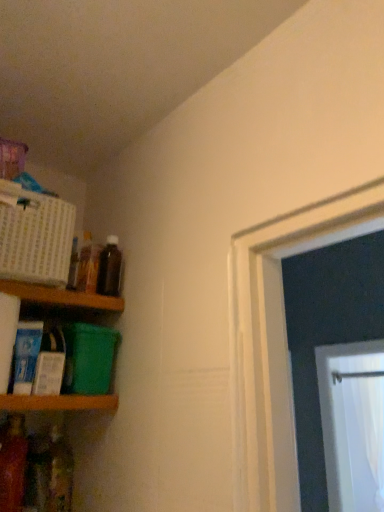
At what (x,y) coordinates should I click in order to perform the action: click on wooden shelf at left, placed as the second shelf when sorted from bottom to top. Please return your answer as a coordinate pair (x, y). Looking at the image, I should click on (61, 297).

What do you see at coordinates (54, 472) in the screenshot?
I see `translucent plastic bottle at lower left, placed as the fourth bottle when sorted from top to bottom` at bounding box center [54, 472].

Image resolution: width=384 pixels, height=512 pixels. Find the location of `translucent plastic bottle at lower left, arranged as the fourth bottle when viewed from the right`. translucent plastic bottle at lower left, arranged as the fourth bottle when viewed from the right is located at coordinates (13, 464).

This screenshot has width=384, height=512. I want to click on wooden shelf at left, placed as the second shelf when sorted from bottom to top, so click(61, 297).

Is translucent plastic bottle at lower left, arranged as the fourth bottle when viewed from the right, aimed at wooden shelf at lower left, arranged as the second shelf when viewed from the top?

No, translucent plastic bottle at lower left, arranged as the fourth bottle when viewed from the right, is not turned towards wooden shelf at lower left, arranged as the second shelf when viewed from the top.

Between translucent plastic bottle at lower left, arranged as the fourth bottle when viewed from the right, and wooden shelf at lower left, placed as the 1th shelf when sorted from bottom to top, which one has larger size?

With larger size is wooden shelf at lower left, placed as the 1th shelf when sorted from bottom to top.

From the image's perspective, is translucent plastic bottle at lower left, placed as the 3th bottle when sorted from top to bottom, above or below wooden shelf at lower left, arranged as the second shelf when viewed from the top?

translucent plastic bottle at lower left, placed as the 3th bottle when sorted from top to bottom, is below wooden shelf at lower left, arranged as the second shelf when viewed from the top.

Who is taller, translucent plastic bottle at lower left, which is the 2th bottle in bottom-to-top order, or wooden shelf at lower left, arranged as the second shelf when viewed from the top?

translucent plastic bottle at lower left, which is the 2th bottle in bottom-to-top order, is taller.

Based on their positions, is brown glass bottle at upper left, which is the fourth bottle from left to right, located to the left or right of translucent plastic bottle at lower left, which appears as the 1th bottle when ordered from the bottom?

From the image, it's evident that brown glass bottle at upper left, which is the fourth bottle from left to right, is to the right of translucent plastic bottle at lower left, which appears as the 1th bottle when ordered from the bottom.

Is brown glass bottle at upper left, which is the 4th bottle in bottom-to-top order, surrounding translucent plastic bottle at lower left, which is the third bottle in right-to-left order?

No.

Does point (104, 256) come in front of point (49, 453)?

Yes, point (104, 256) is closer to viewer.

Based on the photo, which of these two, brown glass bottle at upper left, the 1th bottle when ordered from right to left, or translucent plastic bottle at lower left, the 2th bottle from the left, stands taller?

Standing taller between the two is translucent plastic bottle at lower left, the 2th bottle from the left.

What's the angular difference between wooden shelf at lower left, placed as the 1th shelf when sorted from bottom to top, and wooden shelf at left, which is counted as the 1th shelf, starting from the top,'s facing directions?

There is a 0-degree angle between the facing directions of wooden shelf at lower left, placed as the 1th shelf when sorted from bottom to top, and wooden shelf at left, which is counted as the 1th shelf, starting from the top.

Would you say wooden shelf at lower left, arranged as the second shelf when viewed from the top, is inside or outside wooden shelf at left, placed as the second shelf when sorted from bottom to top?

wooden shelf at lower left, arranged as the second shelf when viewed from the top, lies outside wooden shelf at left, placed as the second shelf when sorted from bottom to top.

Considering the relative positions of wooden shelf at lower left, placed as the 1th shelf when sorted from bottom to top, and wooden shelf at left, which is counted as the 1th shelf, starting from the top, in the image provided, is wooden shelf at lower left, placed as the 1th shelf when sorted from bottom to top, to the left or to the right of wooden shelf at left, which is counted as the 1th shelf, starting from the top,?

wooden shelf at lower left, placed as the 1th shelf when sorted from bottom to top, is to the left of wooden shelf at left, which is counted as the 1th shelf, starting from the top.

Is wooden shelf at lower left, placed as the 1th shelf when sorted from bottom to top, oriented away from wooden shelf at left, which is counted as the 1th shelf, starting from the top?

No.

Can you confirm if translucent glass bottle at upper left, marked as the third bottle in a bottom-to-top arrangement, is bigger than wooden shelf at lower left, placed as the 1th shelf when sorted from bottom to top?

Actually, translucent glass bottle at upper left, marked as the third bottle in a bottom-to-top arrangement, might be smaller than wooden shelf at lower left, placed as the 1th shelf when sorted from bottom to top.

Could you tell me if translucent glass bottle at upper left, placed as the second bottle when sorted from right to left, is facing wooden shelf at lower left, arranged as the second shelf when viewed from the top?

No, translucent glass bottle at upper left, placed as the second bottle when sorted from right to left, is not facing towards wooden shelf at lower left, arranged as the second shelf when viewed from the top.

Which is behind, translucent glass bottle at upper left, marked as the third bottle in a bottom-to-top arrangement, or wooden shelf at lower left, arranged as the second shelf when viewed from the top?

translucent glass bottle at upper left, marked as the third bottle in a bottom-to-top arrangement, is further away from the camera.

Is point (78, 285) positioned in front of point (115, 409)?

No, (78, 285) is further to viewer.

Does point (70, 460) appear closer or farther from the camera than point (60, 296)?

Point (70, 460) is positioned farther from the camera compared to point (60, 296).

At what (x,y) coordinates should I click in order to perform the action: click on the 2nd bottle directly beneath the wooden shelf at left, placed as the second shelf when sorted from bottom to top (from a real-world perspective). Please return your answer as a coordinate pair (x, y). This screenshot has height=512, width=384. Looking at the image, I should click on [x=54, y=472].

Based on the photo, is the depth of translucent plastic bottle at lower left, which is the third bottle in right-to-left order, greater than that of wooden shelf at left, placed as the second shelf when sorted from bottom to top?

Yes, it is.

Does point (90, 274) come farther from viewer compared to point (101, 264)?

No, it is in front of (101, 264).

Is translucent glass bottle at upper left, placed as the second bottle when sorted from right to left, facing away from brown glass bottle at upper left, which is the first bottle from top to bottom?

No, translucent glass bottle at upper left, placed as the second bottle when sorted from right to left,'s orientation is not away from brown glass bottle at upper left, which is the first bottle from top to bottom.

Measure the distance from translucent glass bottle at upper left, placed as the second bottle when sorted from right to left, to brown glass bottle at upper left, which is the first bottle from top to bottom.

translucent glass bottle at upper left, placed as the second bottle when sorted from right to left, and brown glass bottle at upper left, which is the first bottle from top to bottom, are 1.31 inches apart.

Which of these two, translucent glass bottle at upper left, acting as the 2th bottle starting from the top, or brown glass bottle at upper left, which is the fourth bottle from left to right, is smaller?

translucent glass bottle at upper left, acting as the 2th bottle starting from the top.

The height and width of the screenshot is (512, 384). What are the coordinates of `the 1st bottle located beneath the wooden shelf at left, which is counted as the 1th shelf, starting from the top (from a real-world perspective)` in the screenshot? It's located at (13, 464).

In the image, is wooden shelf at left, placed as the second shelf when sorted from bottom to top, on the left side or the right side of translucent plastic bottle at lower left, placed as the 3th bottle when sorted from top to bottom?

Clearly, wooden shelf at left, placed as the second shelf when sorted from bottom to top, is on the left of translucent plastic bottle at lower left, placed as the 3th bottle when sorted from top to bottom, in the image.

From the image's perspective, between wooden shelf at left, placed as the second shelf when sorted from bottom to top, and translucent plastic bottle at lower left, which is the 2th bottle in bottom-to-top order, which one is located above?

wooden shelf at left, placed as the second shelf when sorted from bottom to top, from the image's perspective.

Which point is more distant from viewer, [9,292] or [22,453]?

The point [22,453] is farther from the camera.

There is a wooden shelf at lower left, arranged as the second shelf when viewed from the top. Find the location of `the 1st bottle below it (from a real-world perspective)`. the 1st bottle below it (from a real-world perspective) is located at coordinates (13, 464).

Locate an element on the screen. The height and width of the screenshot is (512, 384). the 2nd bottle counting from the right side of the translucent plastic bottle at lower left, placed as the fourth bottle when sorted from top to bottom is located at coordinates (109, 268).

Looking at the image, which one is located further to translucent plastic bottle at lower left, placed as the 3th bottle when sorted from top to bottom, translucent plastic bottle at lower left, which is the third bottle in right-to-left order, or wooden shelf at left, placed as the second shelf when sorted from bottom to top?

Among the two, wooden shelf at left, placed as the second shelf when sorted from bottom to top, is located further to translucent plastic bottle at lower left, placed as the 3th bottle when sorted from top to bottom.

Estimate the real-world distances between objects in this image. Which object is closer to wooden shelf at lower left, placed as the 1th shelf when sorted from bottom to top, translucent plastic bottle at lower left, placed as the 3th bottle when sorted from top to bottom, or brown glass bottle at upper left, which is the fourth bottle from left to right?

translucent plastic bottle at lower left, placed as the 3th bottle when sorted from top to bottom, is positioned closer to the anchor wooden shelf at lower left, placed as the 1th shelf when sorted from bottom to top.

Which object lies nearer to the anchor point translucent glass bottle at upper left, marked as the third bottle in a left-to-right arrangement, translucent plastic bottle at lower left, placed as the 3th bottle when sorted from top to bottom, or translucent plastic bottle at lower left, which is the third bottle in right-to-left order?

translucent plastic bottle at lower left, placed as the 3th bottle when sorted from top to bottom, lies closer to translucent glass bottle at upper left, marked as the third bottle in a left-to-right arrangement, than the other object.

From the image, which object appears to be nearer to translucent glass bottle at upper left, placed as the second bottle when sorted from right to left, wooden shelf at left, which is counted as the 1th shelf, starting from the top, or translucent plastic bottle at lower left, the 2th bottle from the left?

wooden shelf at left, which is counted as the 1th shelf, starting from the top, is closer to translucent glass bottle at upper left, placed as the second bottle when sorted from right to left.

Looking at the image, which one is located closer to translucent glass bottle at upper left, marked as the third bottle in a left-to-right arrangement, translucent plastic bottle at lower left, arranged as the fourth bottle when viewed from the right, or wooden shelf at left, placed as the second shelf when sorted from bottom to top?

wooden shelf at left, placed as the second shelf when sorted from bottom to top, is positioned closer to the anchor translucent glass bottle at upper left, marked as the third bottle in a left-to-right arrangement.

Considering their positions, is translucent glass bottle at upper left, acting as the 2th bottle starting from the top, positioned closer to translucent plastic bottle at lower left, which is the 1th bottle in left-to-right order, than brown glass bottle at upper left, which is the 4th bottle in bottom-to-top order?

Based on the image, translucent glass bottle at upper left, acting as the 2th bottle starting from the top, appears to be nearer to translucent plastic bottle at lower left, which is the 1th bottle in left-to-right order.

Which object lies nearer to the anchor point brown glass bottle at upper left, which is the 4th bottle in bottom-to-top order, translucent plastic bottle at lower left, which appears as the 1th bottle when ordered from the bottom, or translucent plastic bottle at lower left, arranged as the fourth bottle when viewed from the right?

translucent plastic bottle at lower left, arranged as the fourth bottle when viewed from the right.

Based on their spatial positions, is translucent plastic bottle at lower left, the 2th bottle from the left, or brown glass bottle at upper left, which is the first bottle from top to bottom, further from translucent glass bottle at upper left, acting as the 2th bottle starting from the top?

Based on the image, translucent plastic bottle at lower left, the 2th bottle from the left, appears to be further to translucent glass bottle at upper left, acting as the 2th bottle starting from the top.

This screenshot has height=512, width=384. I want to click on shelf between wooden shelf at left, which is counted as the 1th shelf, starting from the top, and translucent plastic bottle at lower left, arranged as the fourth bottle when viewed from the right, in the vertical direction, so 58,403.

Where is `bottle between translucent glass bottle at upper left, acting as the 2th bottle starting from the top, and translucent plastic bottle at lower left, which is the third bottle in right-to-left order, in the up-down direction`? This screenshot has width=384, height=512. bottle between translucent glass bottle at upper left, acting as the 2th bottle starting from the top, and translucent plastic bottle at lower left, which is the third bottle in right-to-left order, in the up-down direction is located at coordinates (13, 464).

What are the coordinates of `shelf between wooden shelf at lower left, arranged as the second shelf when viewed from the top, and brown glass bottle at upper left, which is the first bottle from top to bottom, in the front-back direction` in the screenshot? It's located at (61, 297).

At what (x,y) coordinates should I click in order to perform the action: click on bottle that lies between wooden shelf at left, placed as the second shelf when sorted from bottom to top, and translucent plastic bottle at lower left, which is the third bottle in right-to-left order, from top to bottom. Please return your answer as a coordinate pair (x, y). The image size is (384, 512). Looking at the image, I should click on (13, 464).